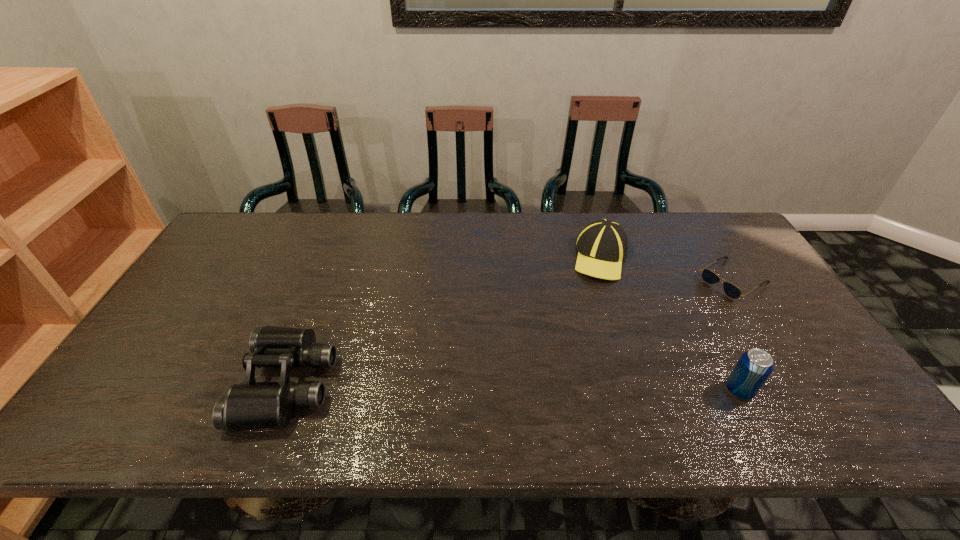
You are a GUI agent. You are given a task and a screenshot of the screen. Output one action in this format:
    pyautogui.click(x=<x>, y=<y>)
    Task: Click on the vacant area at the near edge
    This screenshot has width=960, height=540.
    Given the screenshot: What is the action you would take?
    pyautogui.click(x=339, y=382)

I want to click on free space at the left edge of the desktop, so click(x=220, y=314).

Find the location of a particular element. This screenshot has height=540, width=960. free space at the far left corner of the desktop is located at coordinates (250, 248).

I want to click on free area in between the shortest object and the second object from left to right, so click(x=667, y=268).

Find the location of a particular element. vacant space in between the baseball cap and the rightmost object is located at coordinates (667, 268).

Find the location of a particular element. blank region between the beer can and the leftmost object is located at coordinates (514, 387).

The width and height of the screenshot is (960, 540). In order to click on vacant area that lies between the third object from right to left and the leftmost object in this screenshot , I will do `click(444, 320)`.

Where is `free space between the beer can and the third object from right to left`? This screenshot has height=540, width=960. free space between the beer can and the third object from right to left is located at coordinates (670, 323).

Where is `free space between the rightmost object and the binoculars`? The image size is (960, 540). free space between the rightmost object and the binoculars is located at coordinates (511, 332).

Where is `vacant area between the leftmost object and the third object from right to left`? The image size is (960, 540). vacant area between the leftmost object and the third object from right to left is located at coordinates (444, 320).